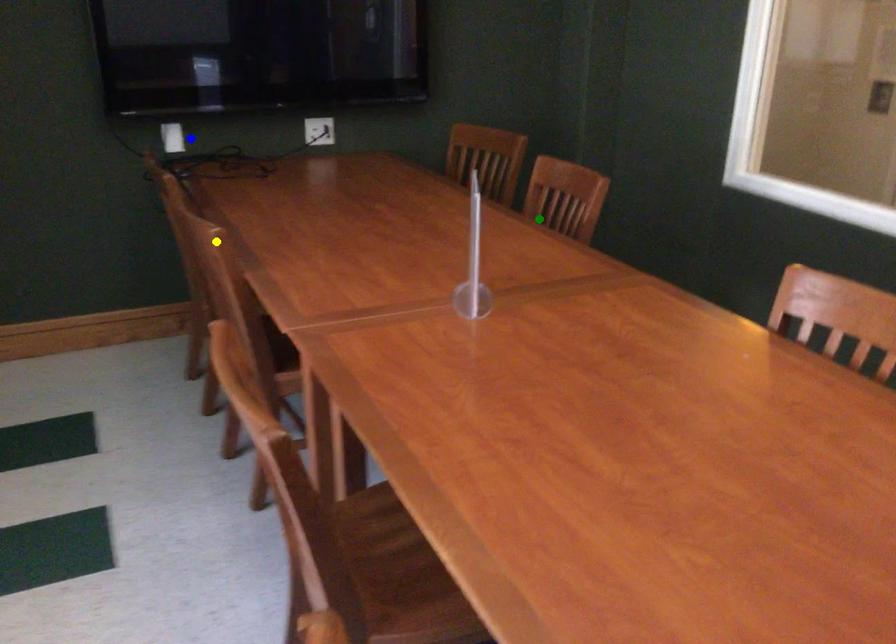
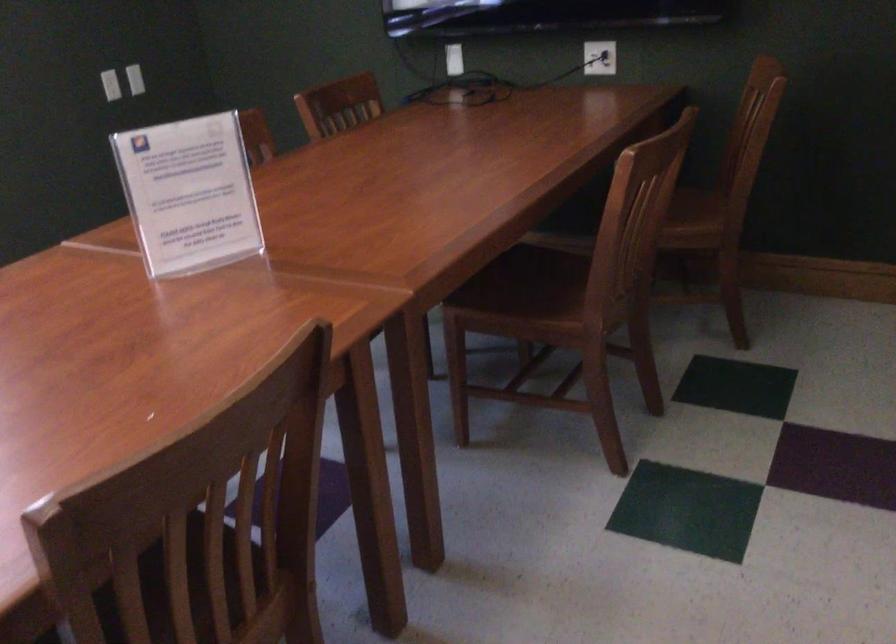
I am providing you with two images of the same scene from different viewpoints. Three points are marked in image1. Which point corresponds to a part or object that is occluded in image2?In image1, three points are marked. Which of them correspond to a part or object that is occluded in image2?Among the three points shown in image1, which one corresponds to a part or object that is no longer visible due to occlusion in image2?

yellow point